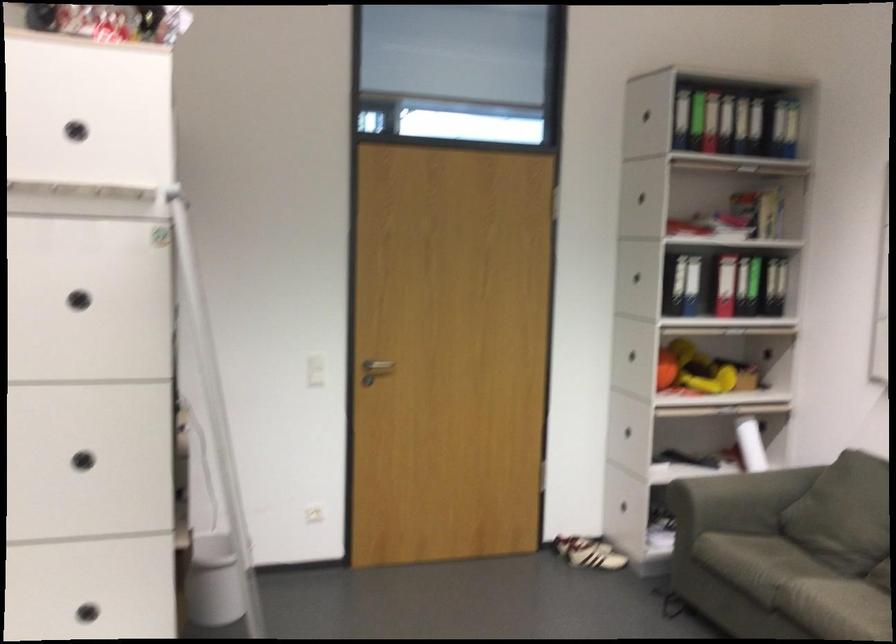
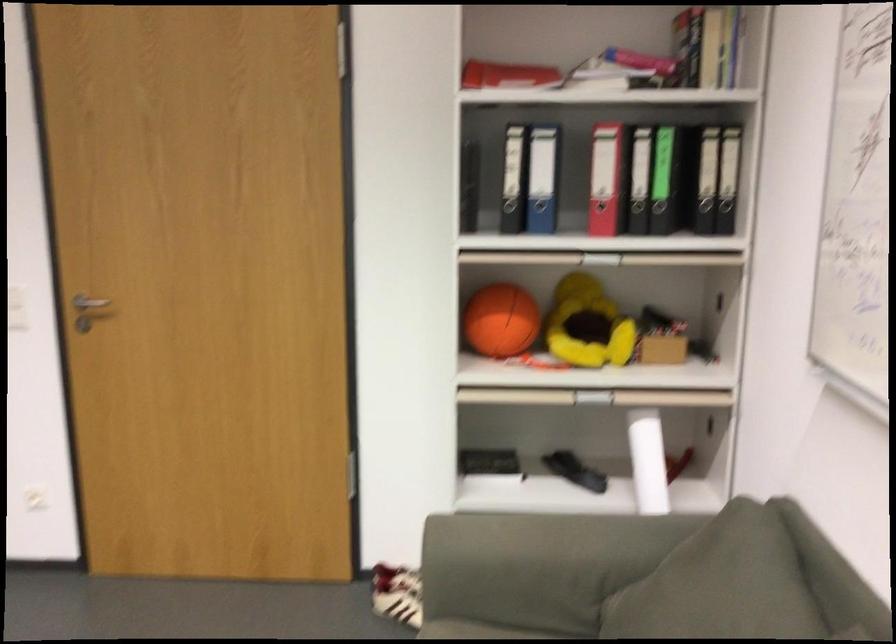
Locate, in the second image, the point that corresponds to point 727,274 in the first image.

(606, 178)